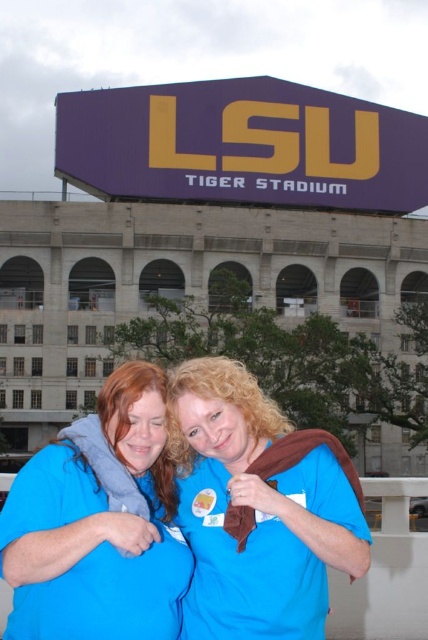
You are standing in front of the LSU Tiger Stadium and see two points marked in the scene. Which point is closer to you, point (169, 378) or point (62, 449)?

Point (169, 378) is further to the viewer than point (62, 449), so the closer point to you is point (62, 449).

You are a photographer trying to capture the LSU Tiger Stadium backdrop with both the blue fabric at center and the blue fabric shirt at center in your shot. Which object should you adjust to ensure both are visible in the frame?

Since the blue fabric at center is to the right of the blue fabric shirt at center, you should adjust the blue fabric shirt at center to move it closer to the blue fabric at center so both can be framed together.

You are an event organizer at LSU Tiger Stadium and need to ensure that the blue fabric at center and the blue fabric shirt at center are visible to the audience. Which object should be placed higher to ensure visibility?

The blue fabric at center should be placed higher since it is taller than the blue fabric shirt at center, ensuring better visibility from the audience seats.